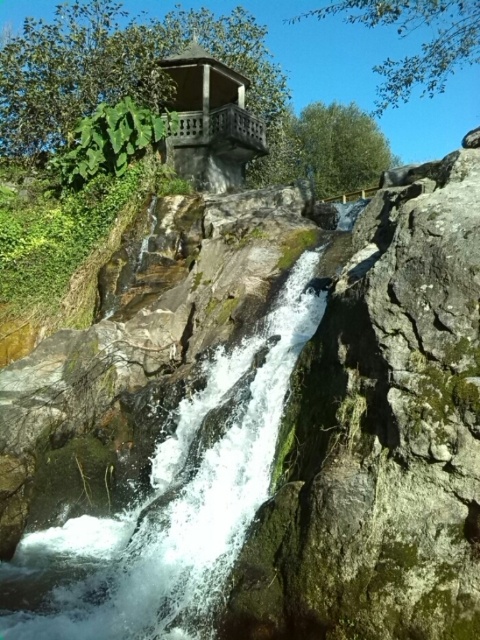
Question: Which point appears closest to the camera in this image?

Choices:
 (A) coord(199,88)
 (B) coord(94,582)

Answer: (B)

Question: Is white frothy water at center closer to the viewer compared to wooden gazebo at upper center?

Choices:
 (A) no
 (B) yes

Answer: (B)

Question: Does white frothy water at center have a smaller size compared to wooden gazebo at upper center?

Choices:
 (A) no
 (B) yes

Answer: (B)

Question: Which point is closer to the camera?

Choices:
 (A) white frothy water at center
 (B) wooden gazebo at upper center

Answer: (A)

Question: Can you confirm if white frothy water at center is bigger than wooden gazebo at upper center?

Choices:
 (A) no
 (B) yes

Answer: (A)